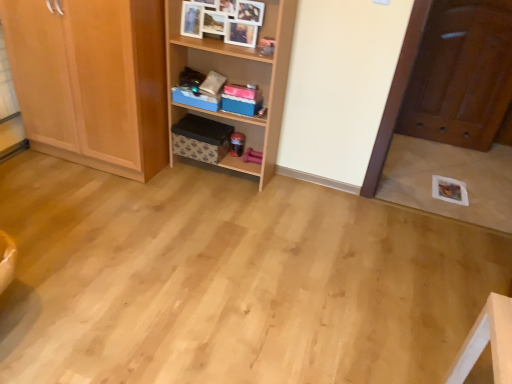
This screenshot has width=512, height=384. Find the location of `empty space that is to the right of wooden shelf at center`. empty space that is to the right of wooden shelf at center is located at coordinates (293, 195).